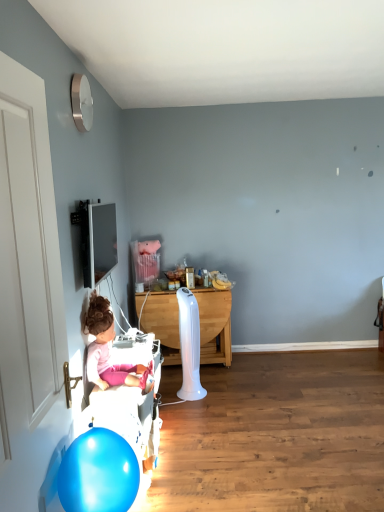
Question: From the image's perspective, is blue glossy balloon at lower left above or below pink fabric doll at lower left?

Choices:
 (A) above
 (B) below

Answer: (B)

Question: In the image, is blue glossy balloon at lower left on the left side or the right side of pink fabric doll at lower left?

Choices:
 (A) left
 (B) right

Answer: (B)

Question: Estimate the real-world distances between objects in this image. Which object is farther from the pink fabric doll at lower left?

Choices:
 (A) white wood table at center
 (B) white fabric bed frame at lower left
 (C) blue glossy balloon at lower left

Answer: (A)

Question: Estimate the real-world distances between objects in this image. Which object is farther from the white wood table at center?

Choices:
 (A) blue glossy balloon at lower left
 (B) white fabric bed frame at lower left
 (C) pink fabric doll at lower left

Answer: (A)